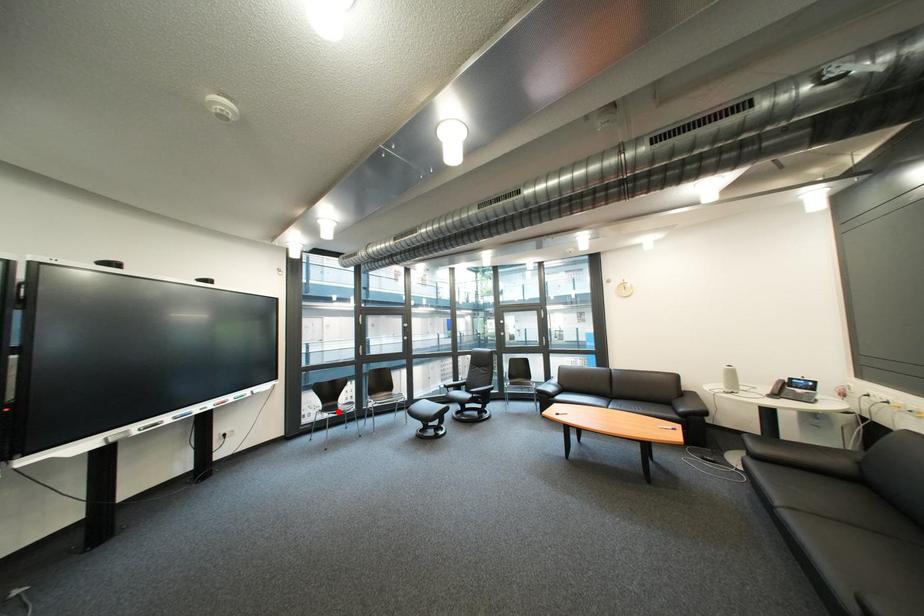
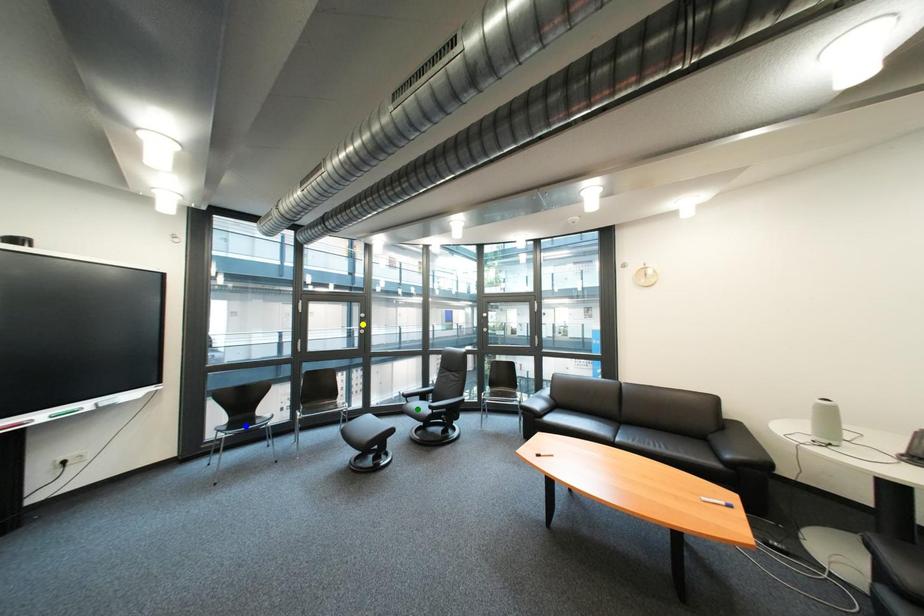
Question: I am providing you with two images of the same scene from different viewpoints. A red point is marked on the first image. You are given multiple points on the second image. Which point in image 2 represents the same 3d spot as the red point in image 1?

Choices:
 (A) blue point
 (B) green point
 (C) yellow point

Answer: (A)